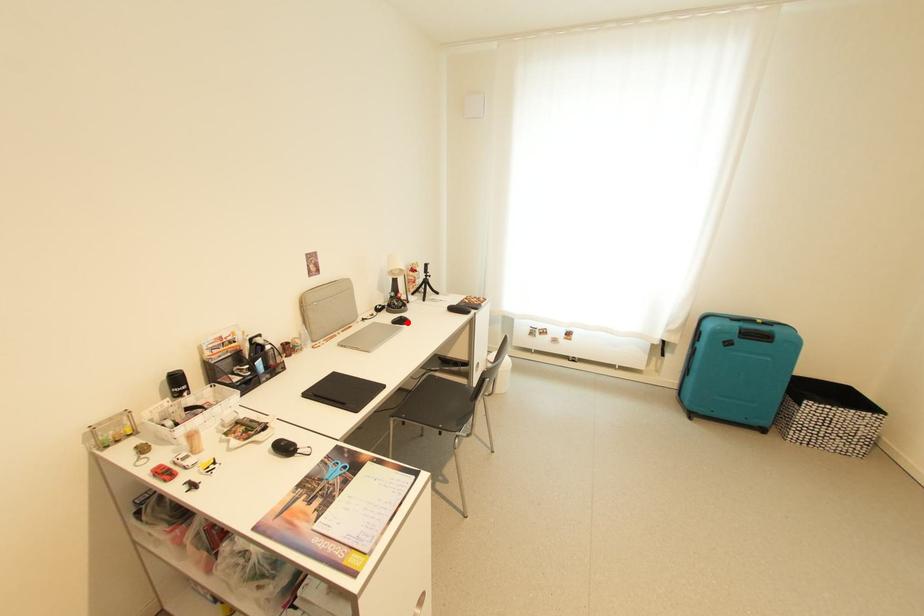
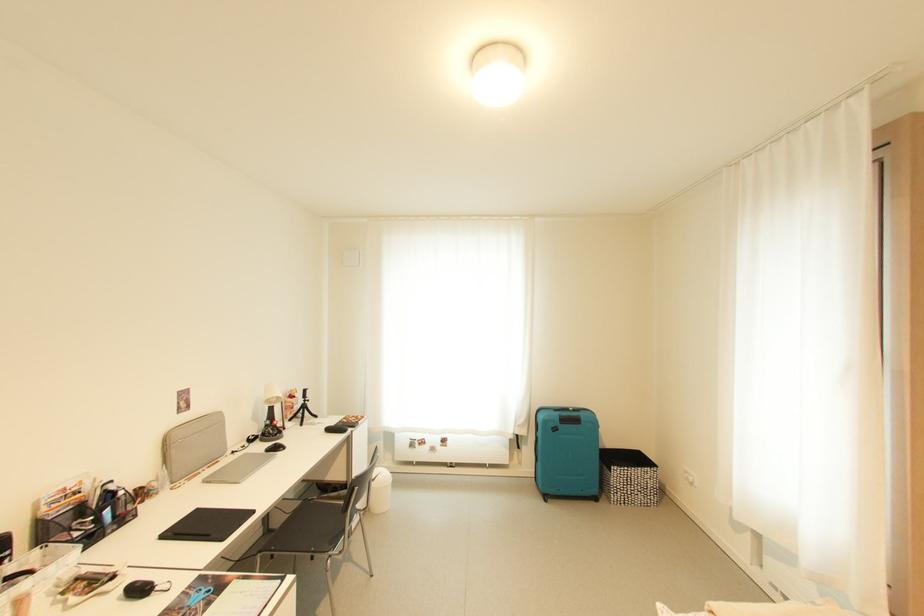
In the second image, find the point that corresponds to the highlighted location in the first image.

(282, 450)